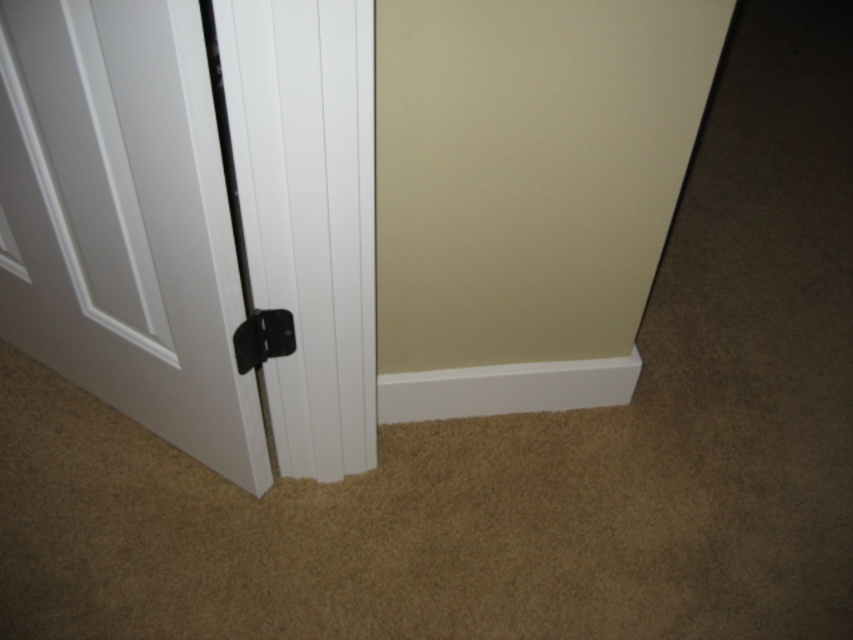
Question: Which object is closer to the camera taking this photo?

Choices:
 (A) white matte door at lower left
 (B) black plastic door handle at center

Answer: (A)

Question: Which point is closer to the camera taking this photo?

Choices:
 (A) (265, 324)
 (B) (71, 16)

Answer: (B)

Question: Can you confirm if white matte door at lower left is positioned below black plastic door handle at center?

Choices:
 (A) no
 (B) yes

Answer: (A)

Question: Can you confirm if white matte door at lower left is smaller than black plastic door handle at center?

Choices:
 (A) no
 (B) yes

Answer: (A)

Question: Is the position of white matte door at lower left more distant than that of black plastic door handle at center?

Choices:
 (A) no
 (B) yes

Answer: (A)